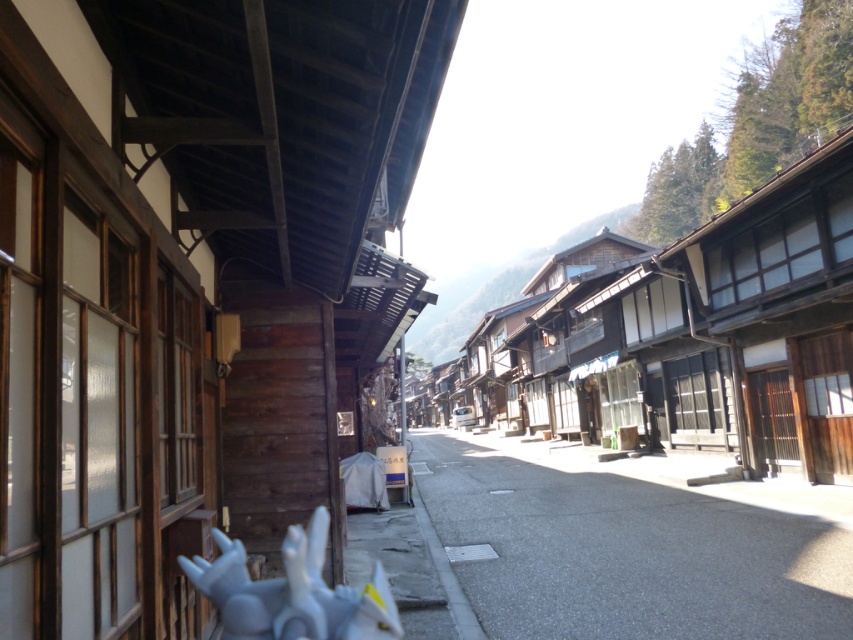
Question: Does wooden buildings at center appear on the left side of white matte statue at lower center?

Choices:
 (A) yes
 (B) no

Answer: (B)

Question: Does wooden buildings at center come in front of smooth concrete street at center?

Choices:
 (A) no
 (B) yes

Answer: (A)

Question: Which of the following is the farthest from the observer?

Choices:
 (A) smooth concrete street at center
 (B) wooden buildings at center

Answer: (B)

Question: Is smooth concrete street at center above white matte statue at lower center?

Choices:
 (A) yes
 (B) no

Answer: (B)

Question: Which point is closer to the camera?

Choices:
 (A) white matte statue at lower center
 (B) smooth concrete street at center

Answer: (A)

Question: Which object is closer to the camera taking this photo?

Choices:
 (A) smooth concrete street at center
 (B) white matte statue at lower center

Answer: (B)